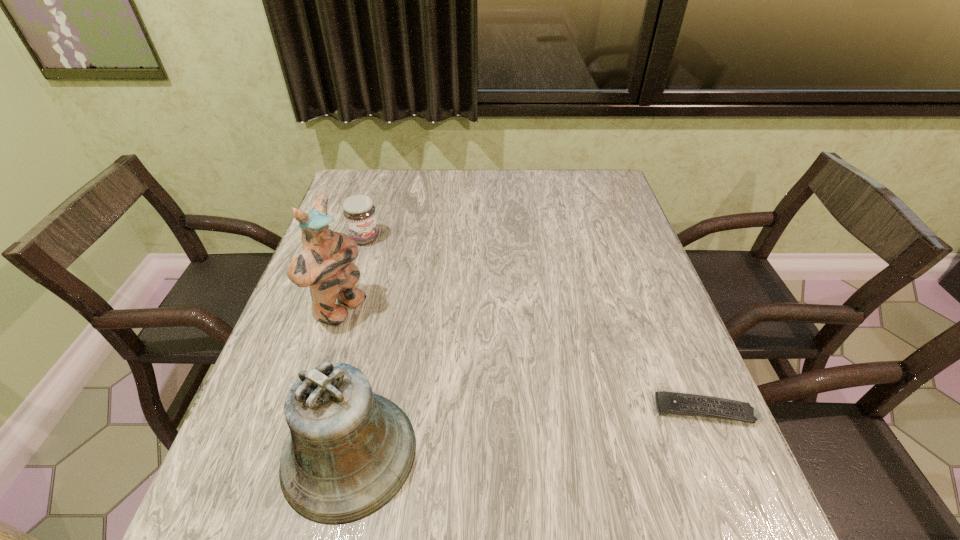
Locate an element on the screen. The height and width of the screenshot is (540, 960). vacant space that is in between the bell and the third tallest object is located at coordinates (357, 345).

You are a GUI agent. You are given a task and a screenshot of the screen. Output one action in this format:
    pyautogui.click(x=<x>, y=<y>)
    Task: Click on the free spot between the second tallest object and the second shortest object
    This screenshot has height=540, width=960.
    Given the screenshot: What is the action you would take?
    pyautogui.click(x=357, y=345)

Where is `free spot between the jam and the third shortest object`? The image size is (960, 540). free spot between the jam and the third shortest object is located at coordinates (357, 345).

Identify the location of object that is the second closest to the farthest object. (349, 452).

Point out which object is positioned as the nearest to the third shortest object. Please provide its 2D coordinates. Your answer should be formatted as a tuple, i.e. [(x, y)], where the tuple contains the x and y coordinates of a point satisfying the conditions above.

[(325, 264)]

Find the location of a particular element. free location that satisfies the following two spatial constraints: 1. on the back side of the bell; 2. on the right side of the remote control is located at coordinates (358, 410).